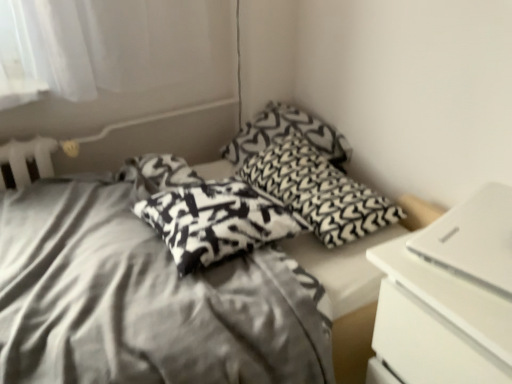
The image size is (512, 384). Find the location of `blank space situated above white matte laptop at right (from a real-world perspective)`. blank space situated above white matte laptop at right (from a real-world perspective) is located at coordinates (484, 228).